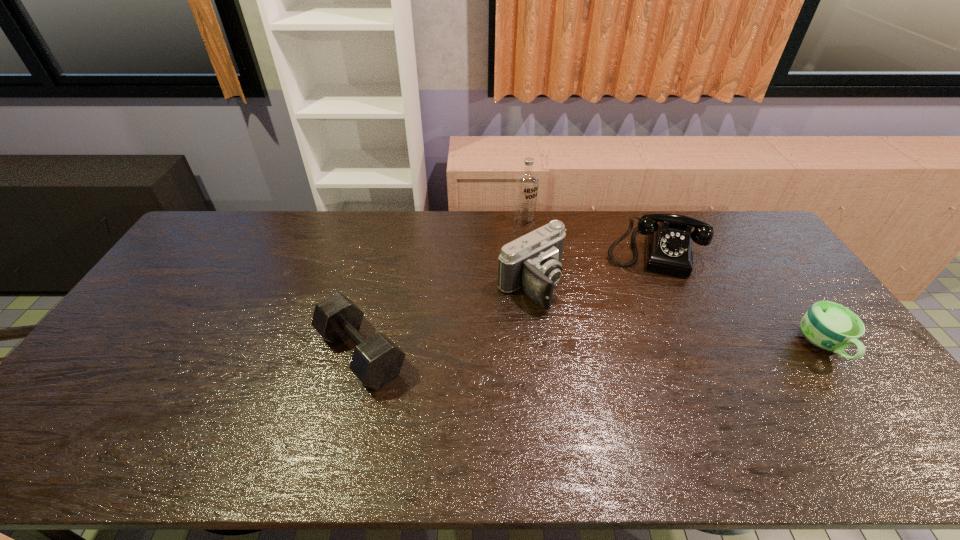
Locate an element on the screen. empty space that is in between the rightmost object and the second shortest object is located at coordinates (592, 349).

Image resolution: width=960 pixels, height=540 pixels. I want to click on free spot between the camera and the second object from right to left, so click(591, 268).

You are a GUI agent. You are given a task and a screenshot of the screen. Output one action in this format:
    pyautogui.click(x=<x>, y=<y>)
    Task: Click on the free spot between the second object from right to left and the fourth tallest object
    
    Given the screenshot: What is the action you would take?
    pyautogui.click(x=507, y=302)

Image resolution: width=960 pixels, height=540 pixels. What are the coordinates of `blank region between the shortest object and the fourth object from left to right` in the screenshot? It's located at (738, 299).

Find the location of `free space between the leftmost object and the camera`. free space between the leftmost object and the camera is located at coordinates (446, 319).

Locate an element on the screen. The width and height of the screenshot is (960, 540). free area in between the camera and the telephone is located at coordinates click(x=591, y=268).

Locate an element on the screen. object that is the second closest to the tallest object is located at coordinates (668, 243).

You are a GUI agent. You are given a task and a screenshot of the screen. Output one action in this format:
    pyautogui.click(x=<x>, y=<y>)
    Task: Click on the closest object to the second shortest object
    
    Given the screenshot: What is the action you would take?
    pyautogui.click(x=532, y=262)

Identify the location of free space that satisfies the following two spatial constraints: 1. on the front side of the camera; 2. on the left side of the shortest object. This screenshot has height=540, width=960. (539, 346).

At what (x,y) coordinates should I click in order to perform the action: click on free region that satisfies the following two spatial constraints: 1. on the back side of the fourth tallest object; 2. on the right side of the vodka. Please return your answer as a coordinate pair (x, y). This screenshot has height=540, width=960. Looking at the image, I should click on (393, 223).